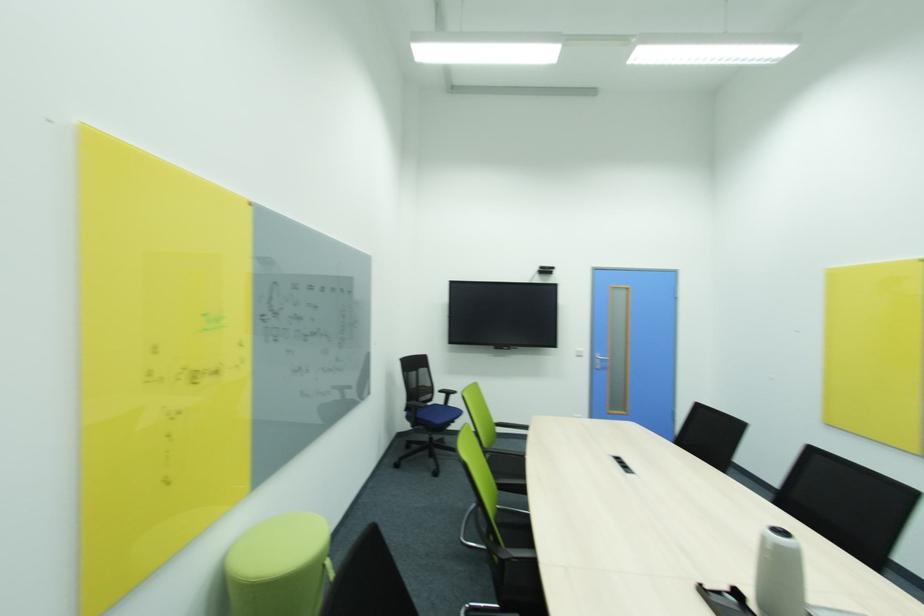
Where would you sit the black chair sitting surface? Please return your answer as a coordinate pair (x, y).

(438, 416)